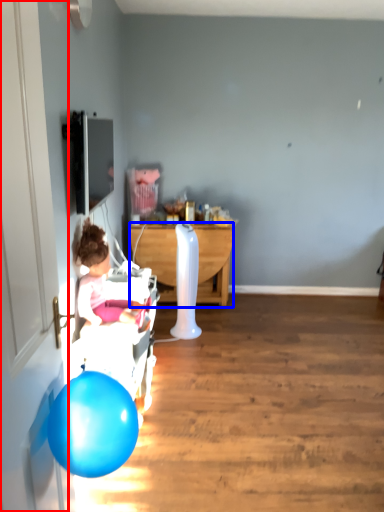
Question: Which of the following is the closest to the observer, door (highlighted by a red box) or desk (highlighted by a blue box)?

Choices:
 (A) door
 (B) desk

Answer: (A)